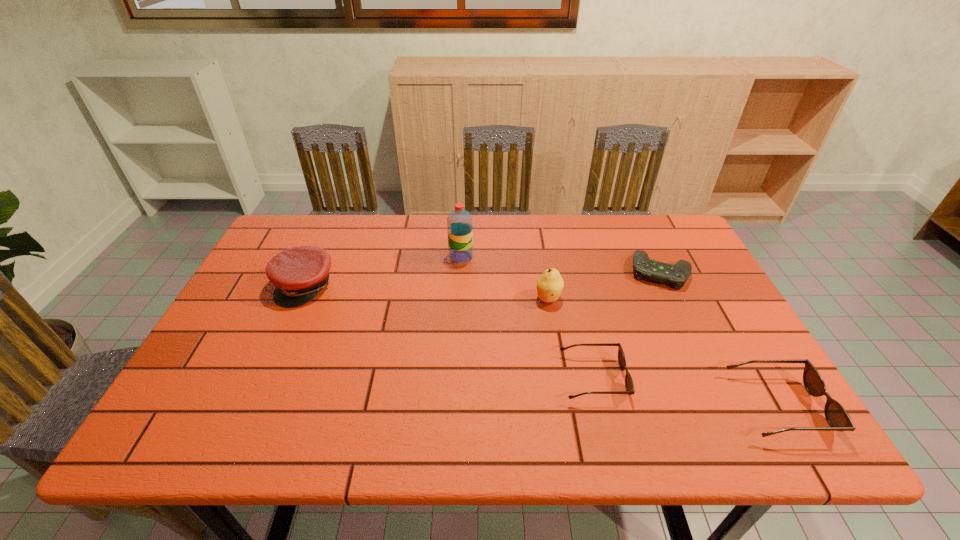
At what (x,y) coordinates should I click in order to perform the action: click on vacant area between the third shortest object and the fifth shortest object. Please return your answer as a coordinate pair (x, y). The height and width of the screenshot is (540, 960). Looking at the image, I should click on (663, 352).

Locate an element on the screen. This screenshot has height=540, width=960. empty location between the taller sunglasses and the left sunglasses is located at coordinates [685, 393].

Locate an element on the screen. The width and height of the screenshot is (960, 540). blank region between the tallest object and the left sunglasses is located at coordinates (527, 318).

The height and width of the screenshot is (540, 960). I want to click on unoccupied area between the cap and the tallest object, so click(383, 271).

This screenshot has width=960, height=540. I want to click on vacant space in between the tallest object and the control, so click(x=561, y=264).

Where is `free space between the control and the fifth shortest object`? The width and height of the screenshot is (960, 540). free space between the control and the fifth shortest object is located at coordinates (604, 285).

Identify which object is located as the fifth nearest to the control. Please provide its 2D coordinates. Your answer should be formatted as a tuple, i.e. [(x, y)], where the tuple contains the x and y coordinates of a point satisfying the conditions above.

[(299, 273)]

This screenshot has width=960, height=540. Find the location of `object that is the fourth closest to the control`. object that is the fourth closest to the control is located at coordinates (459, 222).

The height and width of the screenshot is (540, 960). Identify the location of vacant area in the image that satisfies the following two spatial constraints: 1. on the front label of the fifth object from right to left; 2. on the left side of the control. (460, 272).